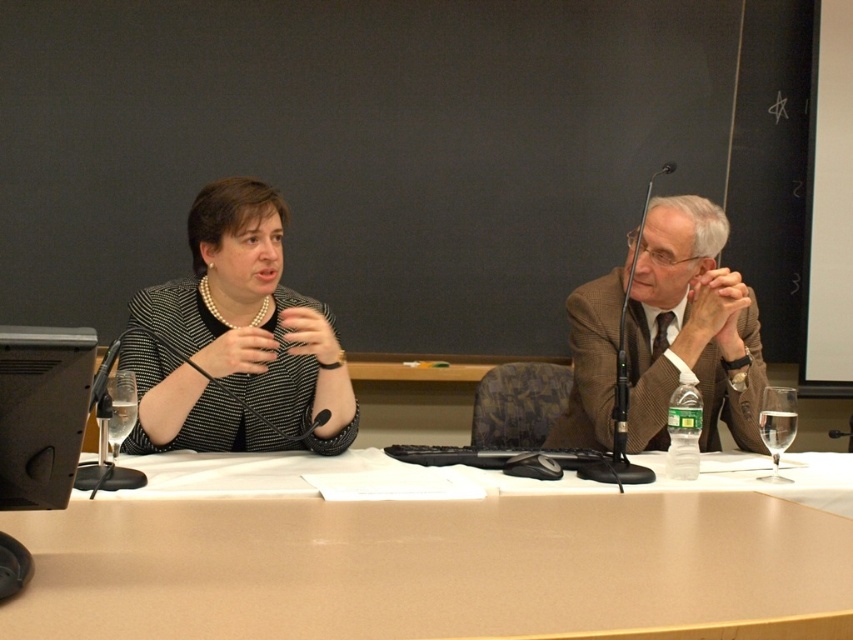
Question: Which of these objects is positioned closest to the brown wooden table at center?

Choices:
 (A) brown textured suit at right
 (B) black textured blazer at left

Answer: (B)

Question: Does black textured blazer at left have a larger size compared to brown textured suit at right?

Choices:
 (A) yes
 (B) no

Answer: (B)

Question: Which object is the farthest from the brown textured suit at right?

Choices:
 (A) black textured blazer at left
 (B) brown wooden table at center

Answer: (A)

Question: Which point is closer to the camera?

Choices:
 (A) (630, 435)
 (B) (241, 284)
 (C) (259, 552)

Answer: (C)

Question: Can you confirm if brown wooden table at center is bigger than black textured blazer at left?

Choices:
 (A) no
 (B) yes

Answer: (A)

Question: Does brown wooden table at center have a greater width compared to black textured blazer at left?

Choices:
 (A) no
 (B) yes

Answer: (B)